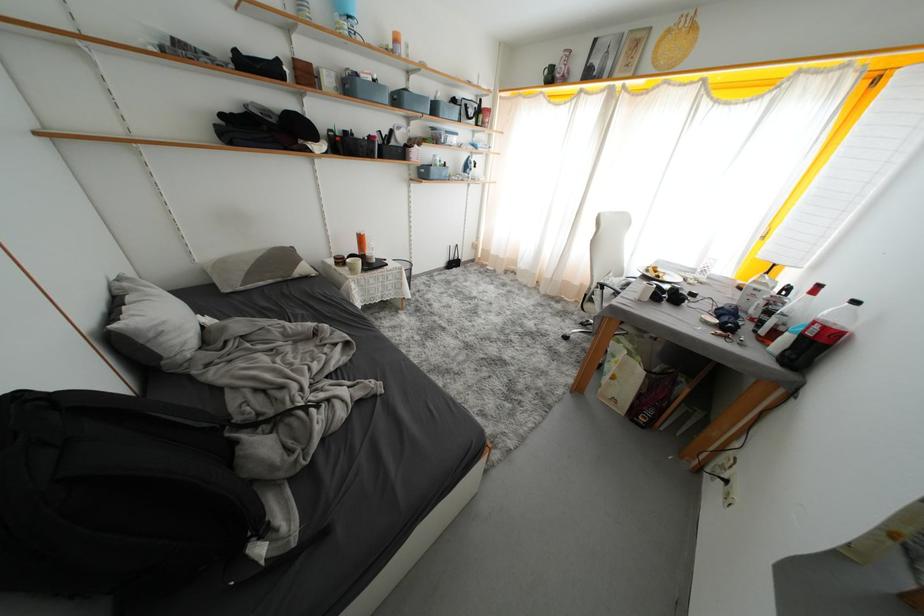
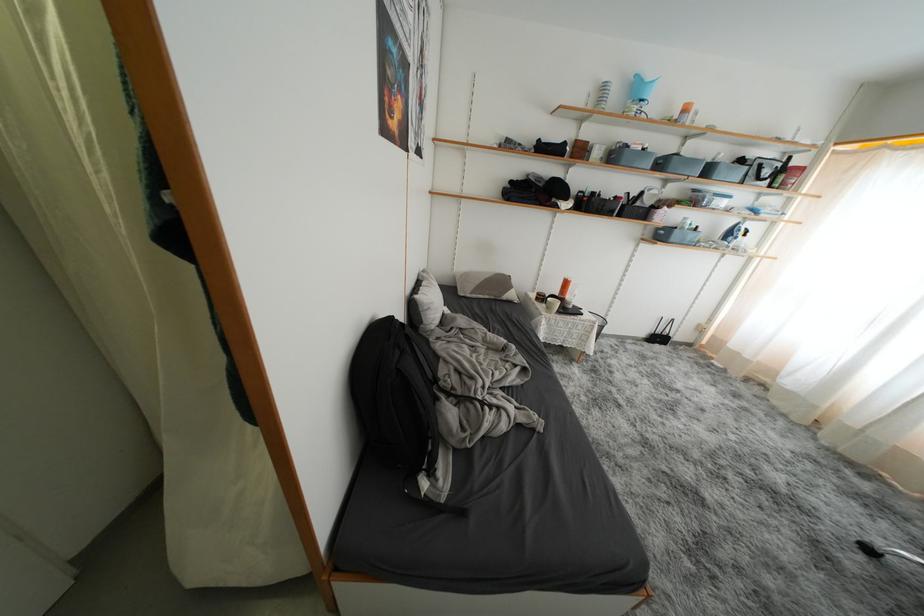
Find the pixel in the second image that matches point (293, 261) in the first image.

(508, 286)